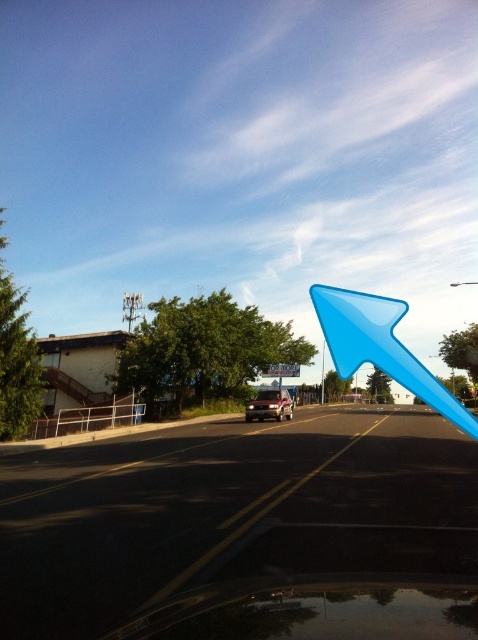
You are a delivery driver who needs to park your vehicle in the black asphalt parking lot at center. Your vehicle is 1.8 meters tall. Can your vehicle safely enter the parking lot without hitting the satin silver suv at center?

The black asphalt parking lot at center has a greater height compared to the satin silver suv at center. Since the parking lot is taller than the SUV, your vehicle which is 1.8 meters tall can safely enter the parking lot without hitting the SUV.

You are driving a car with a trunk that is 3 feet long. You want to park your car in the black asphalt parking lot at center. Based on the distance between your current position and the parking lot, can your car fit entirely within the parking space?

The distance between the black asphalt parking lot at center and the camera is 8.42 feet. Since your car trunk is 3 feet long, the remaining length of the car would require additional space. However, without knowing the total length of the car or the size of the parking space, it is impossible to determine if the car will fit entirely within the parking space.

You are driving a car and notice a white plastic street sign at center and a blue plastic pole at center in your view. Which object is closer to you?

The white plastic street sign at center is closer to you because it is in front of the blue plastic pole at center.